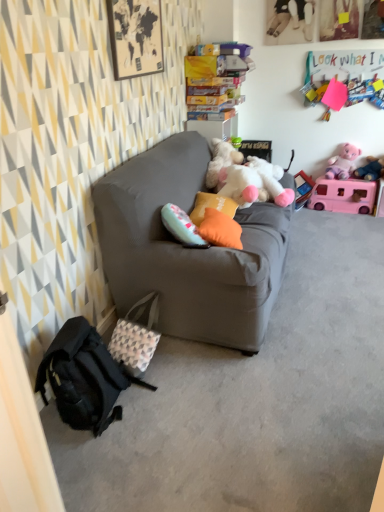
Question: Does patterned fabric bag at lower left come in front of white plush toy at center, marked as the 5th toy in a top-to-bottom arrangement?

Choices:
 (A) yes
 (B) no

Answer: (A)

Question: Can we say patterned fabric bag at lower left lies outside white plush toy at center, marked as the 5th toy in a top-to-bottom arrangement?

Choices:
 (A) yes
 (B) no

Answer: (A)

Question: Is patterned fabric bag at lower left behind white plush toy at center, marked as the 5th toy in a top-to-bottom arrangement?

Choices:
 (A) yes
 (B) no

Answer: (B)

Question: Considering the relative sizes of patterned fabric bag at lower left and white plush toy at center, which appears as the first toy when ordered from the bottom, in the image provided, is patterned fabric bag at lower left wider than white plush toy at center, which appears as the first toy when ordered from the bottom,?

Choices:
 (A) yes
 (B) no

Answer: (B)

Question: Considering the relative sizes of patterned fabric bag at lower left and white plush toy at center, marked as the 5th toy in a top-to-bottom arrangement, in the image provided, is patterned fabric bag at lower left smaller than white plush toy at center, marked as the 5th toy in a top-to-bottom arrangement,?

Choices:
 (A) no
 (B) yes

Answer: (B)

Question: Is patterned fabric bag at lower left spatially inside pink plush toy at upper right, the third toy in the bottom-to-top sequence, or outside of it?

Choices:
 (A) inside
 (B) outside

Answer: (B)

Question: From the image's perspective, is patterned fabric bag at lower left located above or below pink plush toy at upper right, marked as the third toy in a top-to-bottom arrangement?

Choices:
 (A) below
 (B) above

Answer: (A)

Question: Looking at the image, does patterned fabric bag at lower left seem bigger or smaller compared to pink plush toy at upper right, marked as the third toy in a top-to-bottom arrangement?

Choices:
 (A) small
 (B) big

Answer: (B)

Question: Considering the positions of patterned fabric bag at lower left and pink plush toy at upper right, marked as the third toy in a top-to-bottom arrangement, in the image, is patterned fabric bag at lower left taller or shorter than pink plush toy at upper right, marked as the third toy in a top-to-bottom arrangement,?

Choices:
 (A) short
 (B) tall

Answer: (B)

Question: Does point (319, 65) appear closer or farther from the camera than point (342, 158)?

Choices:
 (A) farther
 (B) closer

Answer: (B)

Question: Which is correct: pink felt sign at upper right, marked as the 5th toy in a bottom-to-top arrangement, is inside pink plush toy at upper right, which is counted as the 4th toy, starting from the bottom, or outside of it?

Choices:
 (A) inside
 (B) outside

Answer: (B)

Question: Looking at their shapes, would you say pink felt sign at upper right, marked as the 5th toy in a bottom-to-top arrangement, is wider or thinner than pink plush toy at upper right, positioned as the 2th toy in top-to-bottom order?

Choices:
 (A) thin
 (B) wide

Answer: (A)

Question: From a real-world perspective, is pink felt sign at upper right, the first toy in the top-to-bottom sequence, positioned above or below pink plush toy at upper right, which is counted as the 4th toy, starting from the bottom?

Choices:
 (A) below
 (B) above

Answer: (B)

Question: Is point (198, 321) positioned closer to the camera than point (347, 155)?

Choices:
 (A) closer
 (B) farther

Answer: (A)

Question: Is matte gray couch at center bigger or smaller than pink plush toy at upper right, which is counted as the 4th toy, starting from the bottom?

Choices:
 (A) small
 (B) big

Answer: (B)